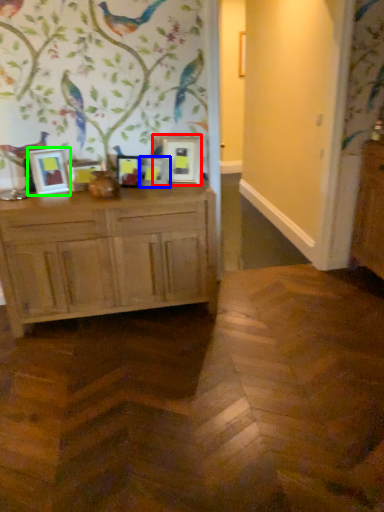
Question: Which is farther away from picture frame (highlighted by a red box)? picture frame (highlighted by a blue box) or picture frame (highlighted by a green box)?

Choices:
 (A) picture frame
 (B) picture frame

Answer: (B)